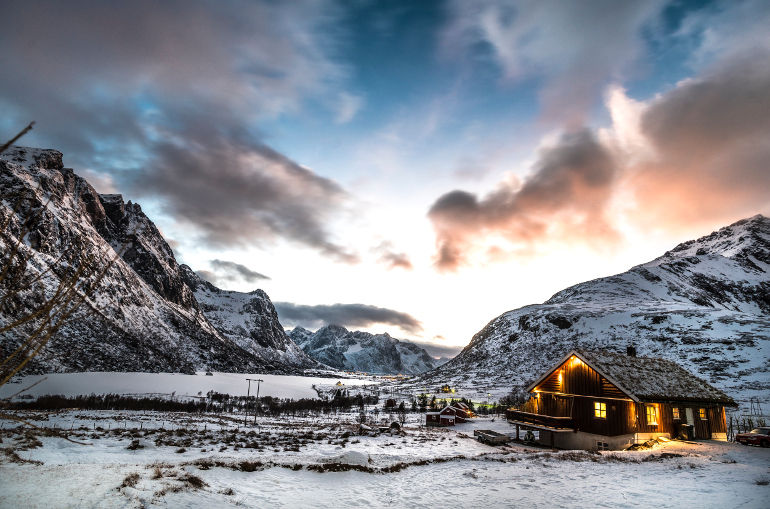
I want to click on door, so click(690, 415).